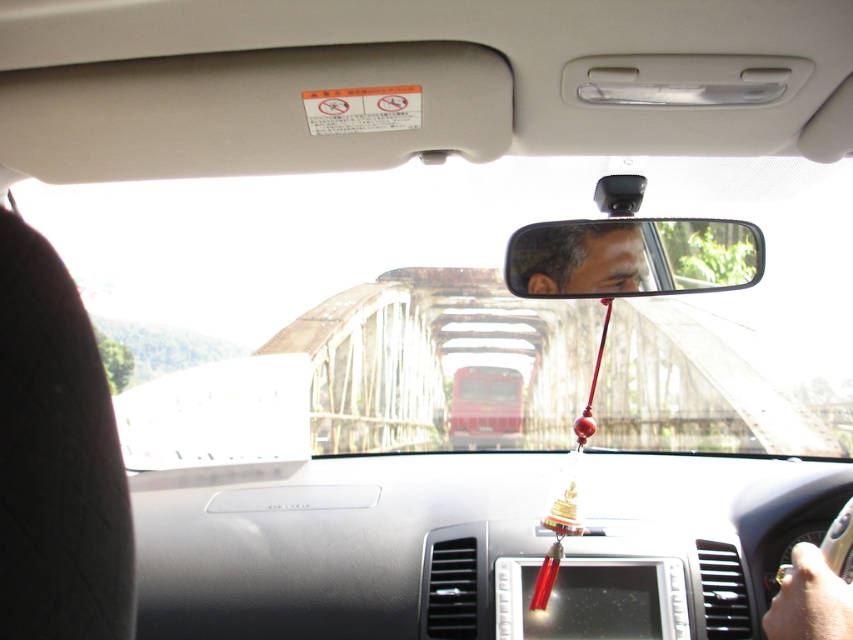
You are a passenger sitting in the car and want to place your phone on the black leather seat at left or the matte black mirror at center. Which surface can accommodate your phone better based on their widths?

The matte black mirror at center is wider than the black leather seat at left, so placing the phone on the matte black mirror at center would provide better stability due to its larger surface area.

You are a passenger in the car and want to know if the transparent glass bridge at center is bigger than the matte black mirror at center. Can you confirm based on what you see from inside the car?

The transparent glass bridge at center has a larger size compared to matte black mirror at center, so yes, the transparent glass bridge at center is bigger than the matte black mirror at center.